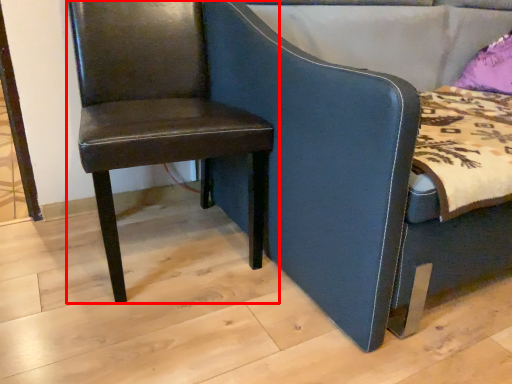
Question: From the image, what is the correct spatial relationship of chair (annotated by the red box) in relation to chair?

Choices:
 (A) right
 (B) left

Answer: (B)